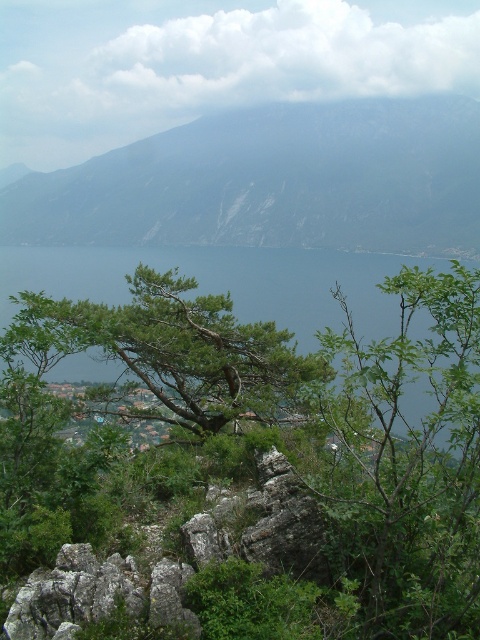
Question: Can you confirm if green leafy branch at center is positioned to the left of green leafy tree at center?

Choices:
 (A) no
 (B) yes

Answer: (A)

Question: Which point is farther from the camera taking this photo?

Choices:
 (A) (444, 557)
 (B) (330, 376)

Answer: (B)

Question: Estimate the real-world distances between objects in this image. Which object is farther from the green leafy branch at center?

Choices:
 (A) rocky gray mountain at upper center
 (B) green leafy tree at center

Answer: (A)

Question: Which object appears farthest from the camera in this image?

Choices:
 (A) green leafy branch at center
 (B) rocky gray mountain at upper center
 (C) green leafy tree at center

Answer: (B)

Question: Is rocky gray mountain at upper center bigger than green leafy branch at center?

Choices:
 (A) yes
 (B) no

Answer: (A)

Question: Does green leafy branch at center appear under green leafy tree at center?

Choices:
 (A) yes
 (B) no

Answer: (B)